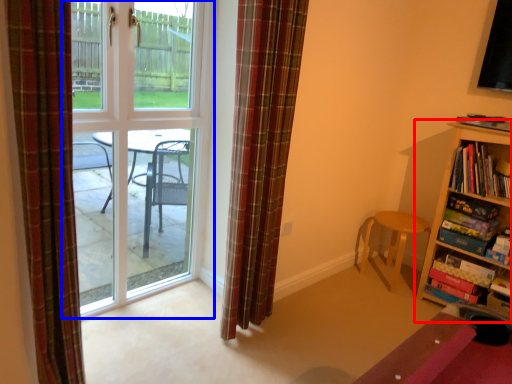
Question: Which object appears farthest to the camera in this image, bookcase (highlighted by a red box) or door (highlighted by a blue box)?

Choices:
 (A) bookcase
 (B) door

Answer: (A)